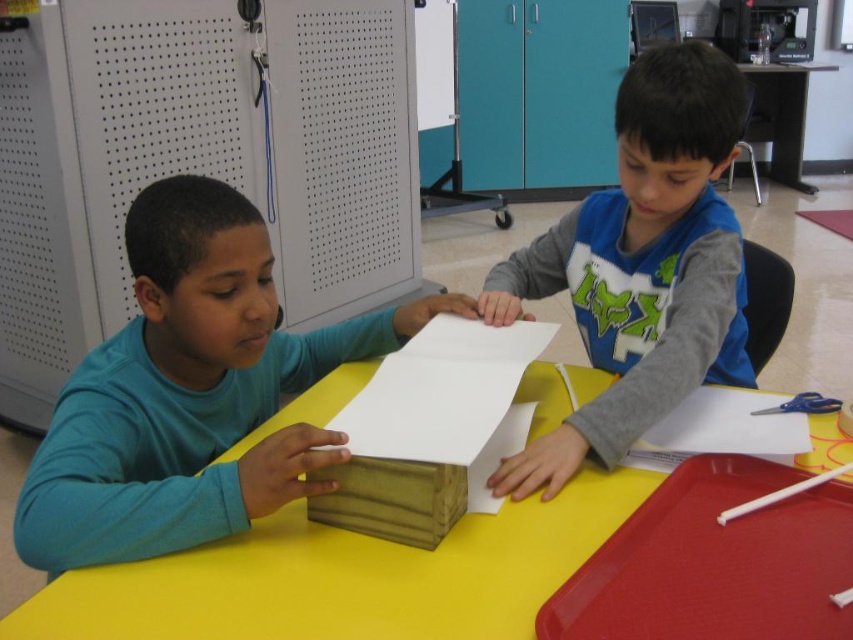
You are a photographer trying to capture a closeup of the two points on the table. Which point, point (x=180, y=321) or point (x=643, y=218), is closer to your camera lens?

Point (x=180, y=321) is closer to the camera lens than point (x=643, y=218).

You have a small toy car that is 10 cm long. You want to place it on the table where the matte wood block at left and the matte gray shirt at center are located. Can the toy car fit entirely on the table without overlapping either object?

The matte wood block at left might be wider than matte gray shirt at center, but since the toy car is only 10 cm long, it can be placed in an area of the table that is not occupied by either object, ensuring it doesn

Looking at this image, what are the coordinates of the matte wood block at left?

The coordinates of the matte wood block at left are at point (x=190, y=392).